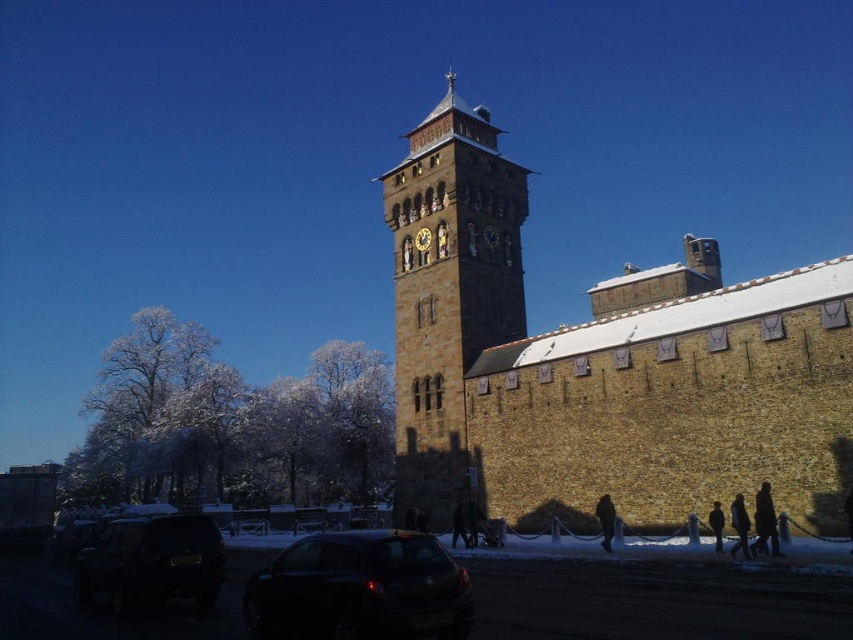
Question: Based on their relative distances, which object is nearer to the shiny black car at lower center?

Choices:
 (A) dark brown leather jacket at lower right
 (B) black matte car at lower left
 (C) black wool coat at lower right
 (D) dark brown leather coat at lower right

Answer: (B)

Question: Is brown stone tower at center wider than black fuzzy coat at lower right?

Choices:
 (A) yes
 (B) no

Answer: (A)

Question: Does brown stone clock tower at center appear over shiny black car at lower center?

Choices:
 (A) yes
 (B) no

Answer: (A)

Question: Which object is positioned closest to the black wool coat at lower right?

Choices:
 (A) brown stone tower at center
 (B) black fuzzy coat at lower right
 (C) dark brown leather jacket at lower right
 (D) dark brown leather coat at lower right

Answer: (D)

Question: Where is brown stone tower at center located in relation to dark brown leather coat at lower right in the image?

Choices:
 (A) left
 (B) right

Answer: (A)

Question: Among these points, which one is farthest from the camera?

Choices:
 (A) (219, 540)
 (B) (343, 573)
 (C) (712, 502)

Answer: (C)